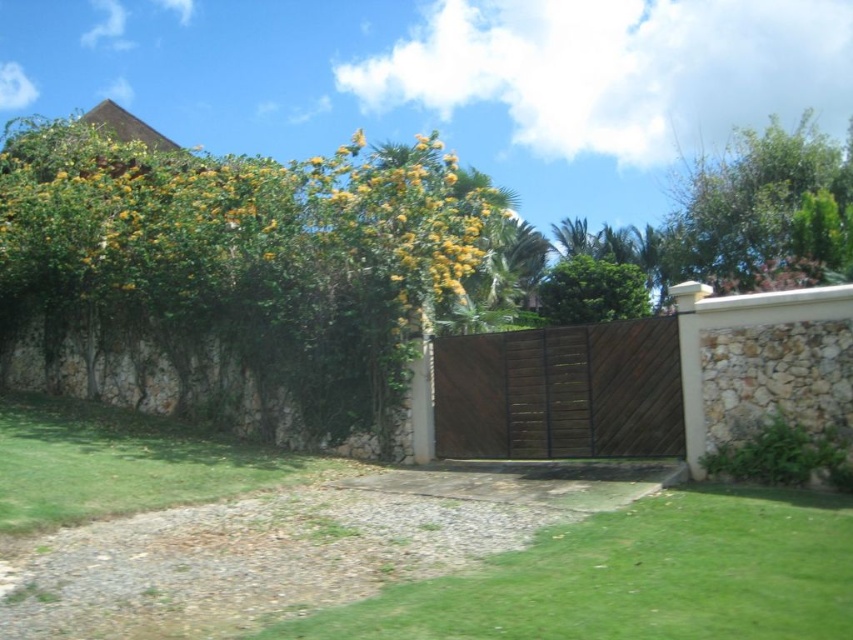
Question: From the image, what is the correct spatial relationship of green leafy tree at upper right in relation to green leafy tree at center?

Choices:
 (A) left
 (B) right

Answer: (B)

Question: Among these points, which one is farthest from the camera?

Choices:
 (A) (674, 236)
 (B) (706, 598)
 (C) (556, 289)

Answer: (A)

Question: Does dark brown wood gate at center come in front of green leafy tree at center?

Choices:
 (A) no
 (B) yes

Answer: (B)

Question: Estimate the real-world distances between objects in this image. Which object is closer to the green leafy tree at center?

Choices:
 (A) dark brown wood gate at center
 (B) green leafy tree at upper right

Answer: (B)

Question: Considering the real-world distances, which object is closest to the green leafy bush at upper left?

Choices:
 (A) green grass at lower center
 (B) green leafy tree at upper right
 (C) dark brown wood gate at center
 (D) green leafy tree at center

Answer: (C)

Question: Is the position of green leafy bush at upper left more distant than that of green leafy tree at upper right?

Choices:
 (A) yes
 (B) no

Answer: (B)